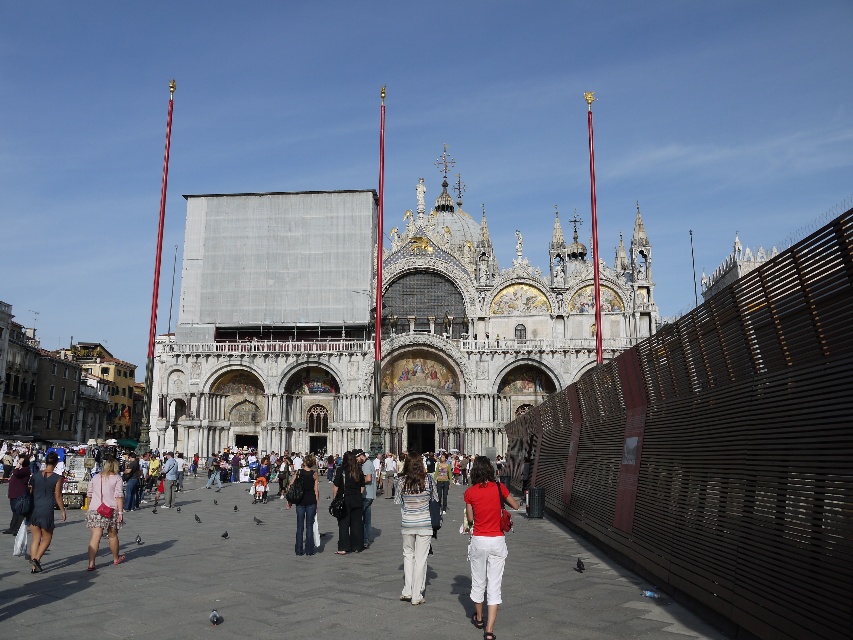
Question: Is striped cotton shirt at center wider than denim jeans at center?

Choices:
 (A) no
 (B) yes

Answer: (A)

Question: Which object is the closest to the denim jeans at center?

Choices:
 (A) striped cotton shirt at center
 (B) matte red shirt at center

Answer: (A)

Question: Is pink fabric purse at lower left further to the viewer compared to denim jeans at center?

Choices:
 (A) yes
 (B) no

Answer: (B)

Question: Which of the following is the farthest from the observer?

Choices:
 (A) white cotton clothing at center
 (B) dark blue dress at lower left

Answer: (B)

Question: Which object is closer to the camera taking this photo?

Choices:
 (A) dark gray jeans at center
 (B) matte red shirt at center

Answer: (B)

Question: Is golden mosaic church at center to the left of dark brown leather jacket at center from the viewer's perspective?

Choices:
 (A) no
 (B) yes

Answer: (A)